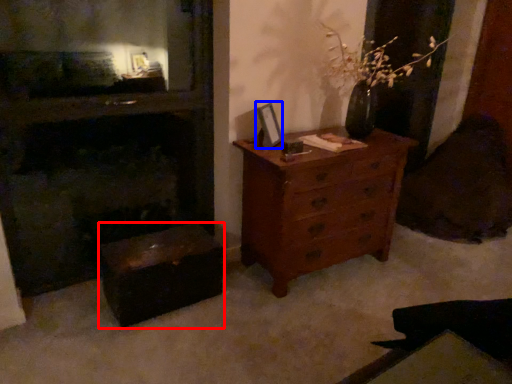
Question: Which of the following is the closest to the observer, vanity (highlighted by a red box) or picture frame (highlighted by a blue box)?

Choices:
 (A) vanity
 (B) picture frame

Answer: (A)